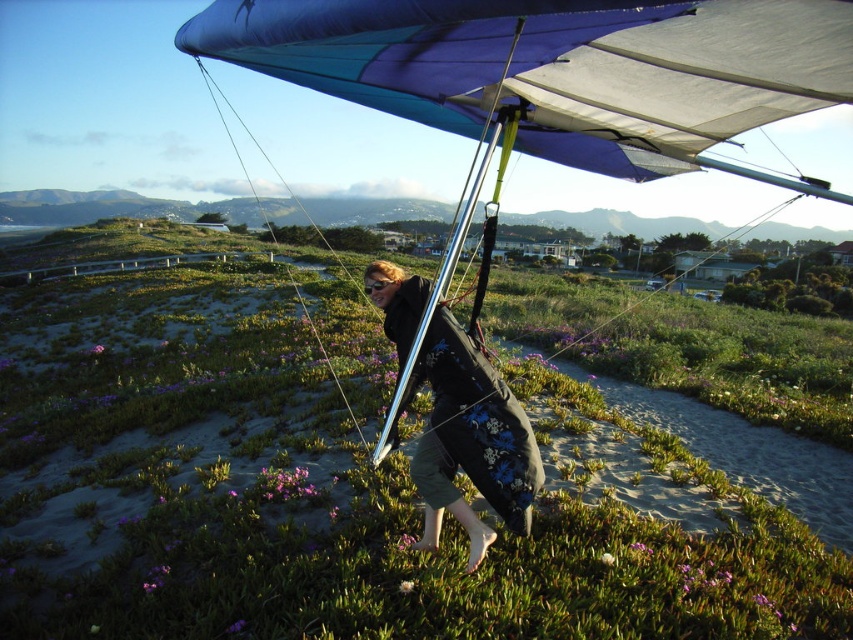
Question: Is the position of green grassy at center more distant than that of blue fabric parachute at center?

Choices:
 (A) no
 (B) yes

Answer: (B)

Question: Is green grassy at center bigger than black floral dress at center?

Choices:
 (A) yes
 (B) no

Answer: (A)

Question: Which object appears closest to the camera in this image?

Choices:
 (A) blue fabric parachute at center
 (B) purple matte flower at lower center
 (C) blue fabric canopy at upper center
 (D) green grassy at center

Answer: (C)

Question: Which point appears farthest from the camera in this image?

Choices:
 (A) (102, 348)
 (B) (811, 13)
 (C) (718, 529)
 (D) (494, 33)

Answer: (A)

Question: Is blue fabric parachute at center to the left of purple matte flower at center from the viewer's perspective?

Choices:
 (A) yes
 (B) no

Answer: (B)

Question: Estimate the real-world distances between objects in this image. Which object is farther from the purple matte flower at center?

Choices:
 (A) blue fabric parachute at center
 (B) purple matte flower at lower center
 (C) green grassy at center

Answer: (A)